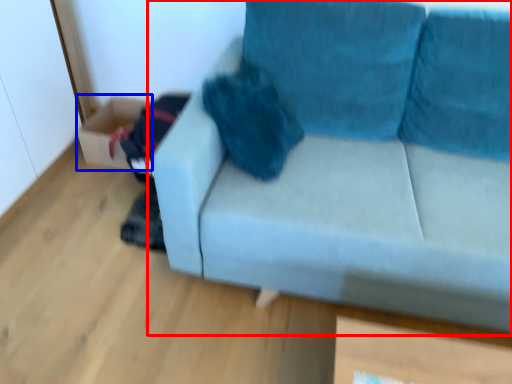
Question: Which point is further to the camera, studio couch (highlighted by a red box) or box (highlighted by a blue box)?

Choices:
 (A) studio couch
 (B) box

Answer: (B)